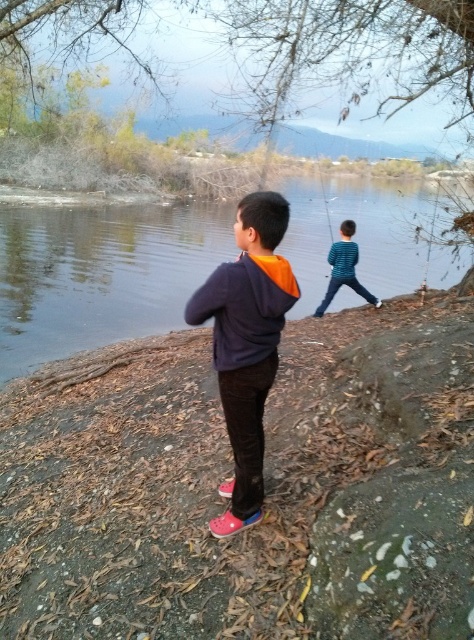
Is the position of orange fleece hoodie at center less distant than that of blue striped shirt at center?

Yes, it is in front of blue striped shirt at center.

Does orange fleece hoodie at center appear on the left side of blue striped shirt at center?

Indeed, orange fleece hoodie at center is positioned on the left side of blue striped shirt at center.

This screenshot has width=474, height=640. Find the location of `orange fleece hoodie at center`. orange fleece hoodie at center is located at coordinates (246, 342).

Does clear water at center appear over blue striped shirt at center?

Yes.

Is clear water at center to the right of blue striped shirt at center from the viewer's perspective?

In fact, clear water at center is to the left of blue striped shirt at center.

This screenshot has width=474, height=640. I want to click on clear water at center, so click(100, 275).

What are the coordinates of `clear water at center` in the screenshot? It's located at tap(100, 275).

Where is `clear water at center`? clear water at center is located at coordinates (100, 275).